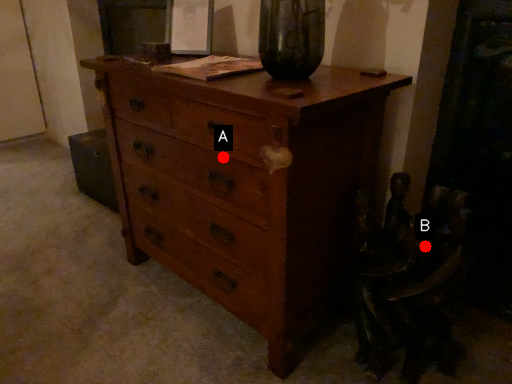
Question: Two points are circled on the image, labeled by A and B beside each circle. Among these points, which one is nearest to the camera?

Choices:
 (A) A is closer
 (B) B is closer

Answer: (A)